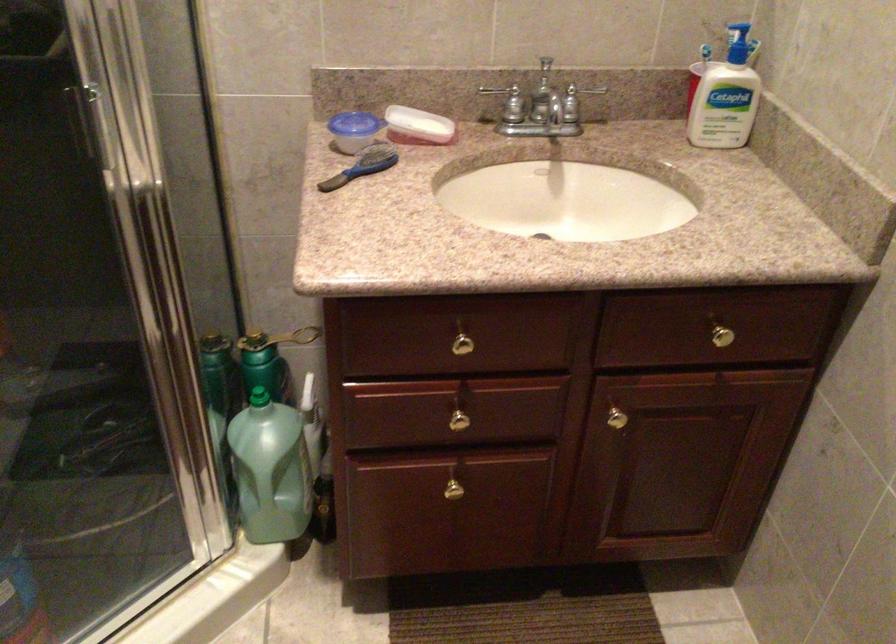
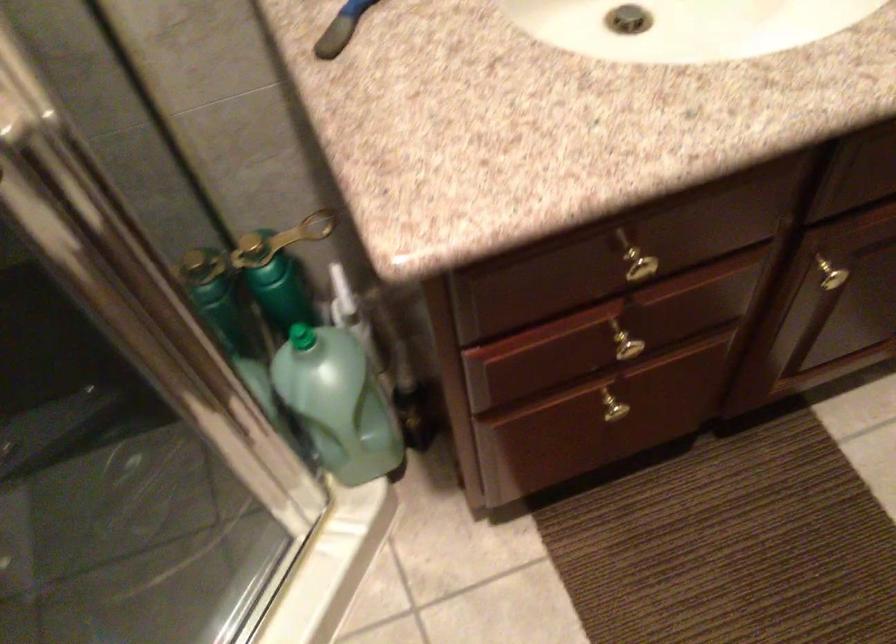
Locate, in the second image, the point that corresponds to [453,489] in the first image.

(616, 411)